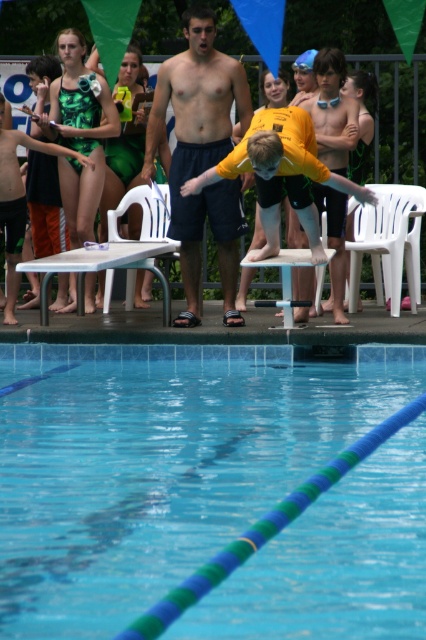
Between dark blue shorts at center and green textured swimsuit at left, which one is positioned higher?

dark blue shorts at center is higher up.

Who is more forward, (186, 212) or (6, 208)?

Positioned in front is point (186, 212).

Where is `dark blue shorts at center`? dark blue shorts at center is located at coordinates (201, 156).

Identify the location of dark blue shorts at center. Image resolution: width=426 pixels, height=640 pixels. (201, 156).

Can you confirm if dark blue shorts at center is wider than yellow matte swimsuit at center?

Yes, dark blue shorts at center is wider than yellow matte swimsuit at center.

Does dark blue shorts at center have a lesser width compared to yellow matte swimsuit at center?

No.

What do you see at coordinates (201, 156) in the screenshot? The width and height of the screenshot is (426, 640). I see `dark blue shorts at center` at bounding box center [201, 156].

This screenshot has width=426, height=640. Find the location of `dark blue shorts at center`. dark blue shorts at center is located at coordinates (201, 156).

Based on the photo, is yellow matte shirt at center positioned in front of yellow matte swimsuit at center?

Yes.

Is point (313, 147) farther from viewer compared to point (336, 244)?

No, it is not.

Identify the location of yellow matte shirt at center. (281, 173).